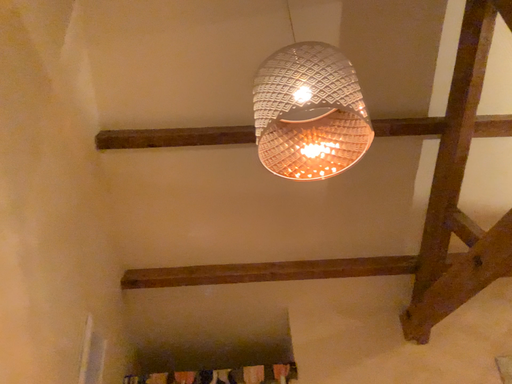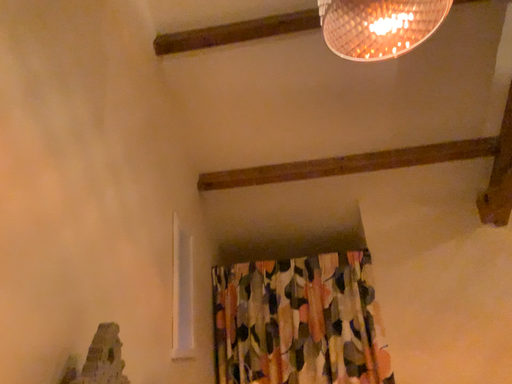
Question: How did the camera likely rotate when shooting the video?

Choices:
 (A) rotated downward
 (B) rotated upward

Answer: (A)